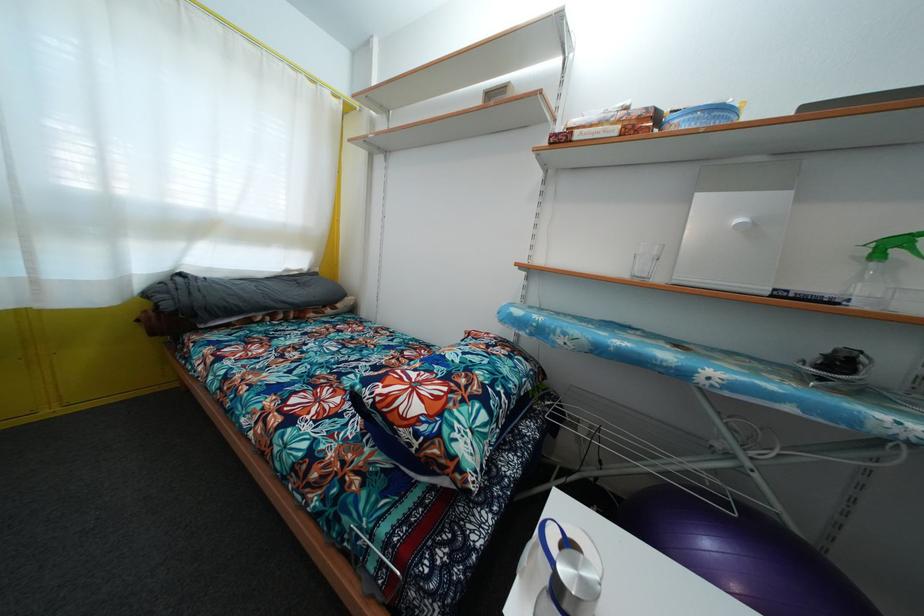
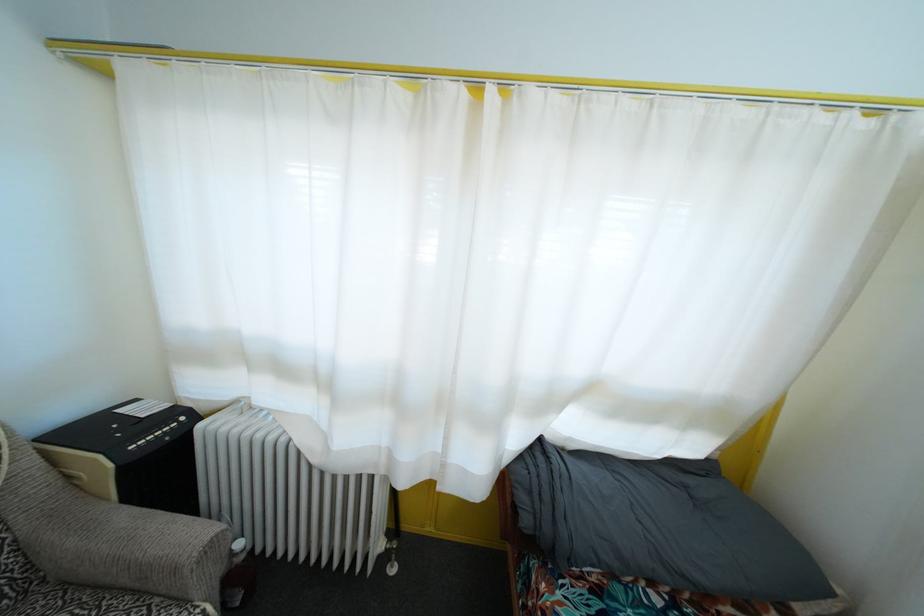
Find the pixel in the second image that matches [171,312] in the first image.

(529, 528)